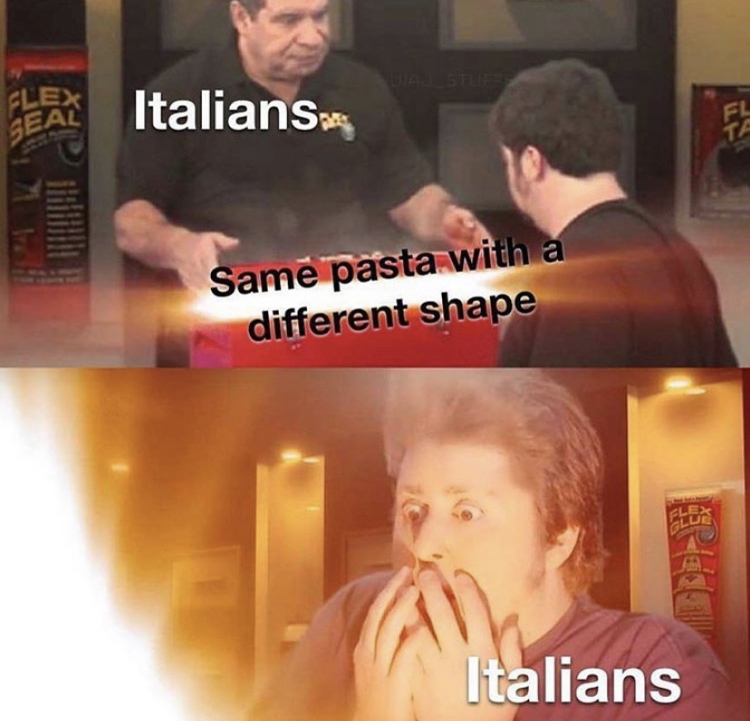
The image size is (750, 721). I want to click on beige wall, so (x=699, y=65).